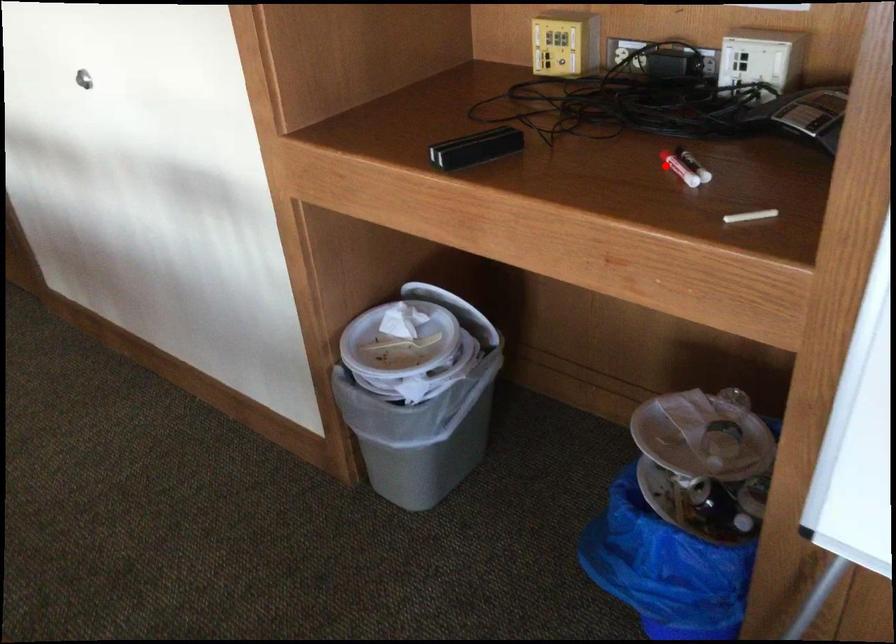
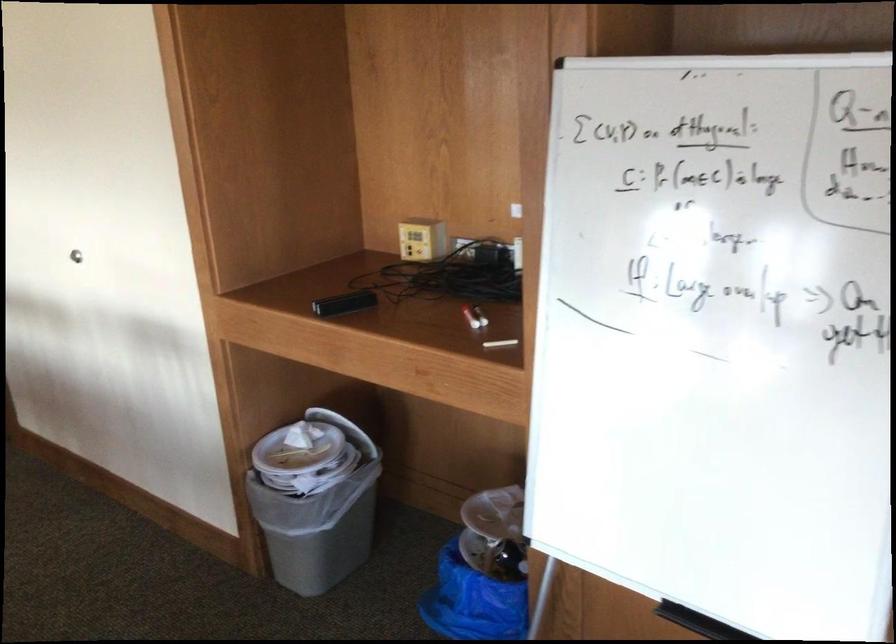
Locate, in the second image, the point that corresponds to the highlighted location in the first image.

(464, 316)